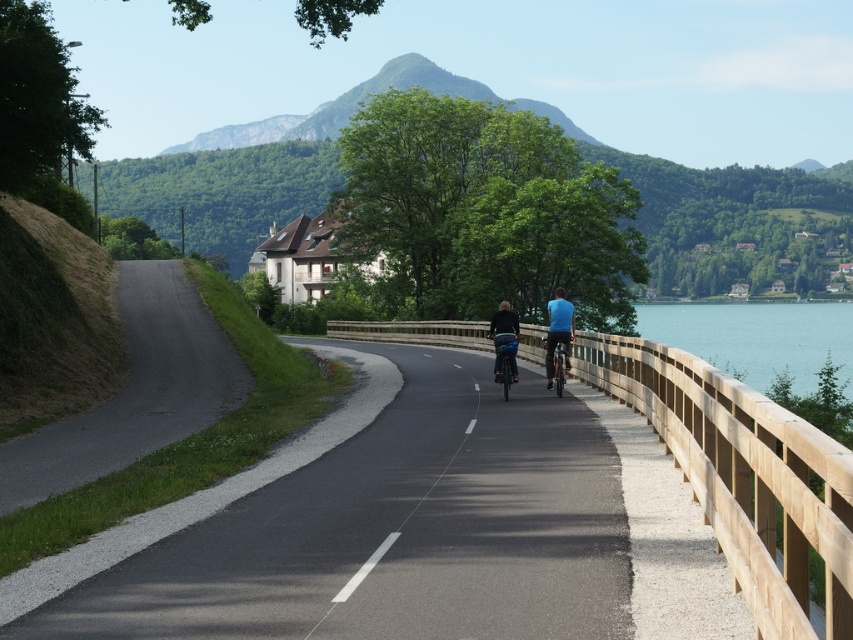
From the picture: You are a photographer trying to capture both the blue matte shirt at center and the orange matte bicycle at center in a single frame. Based on their sizes in the image, which object should you focus on first to ensure both are clearly visible?

The blue matte shirt at center is larger in size than the orange matte bicycle at center, so you should focus on the blue matte shirt at center first to ensure both are clearly visible.

You are standing at the starting point of the road and want to reach the point marked as point [500,362]. There is an obstacle at point [560,308]. Can you safely go around the obstacle and continue towards your destination?

Yes, since point [560,308] is closer to you than point [500,362], you can go around the obstacle and continue towards your destination.